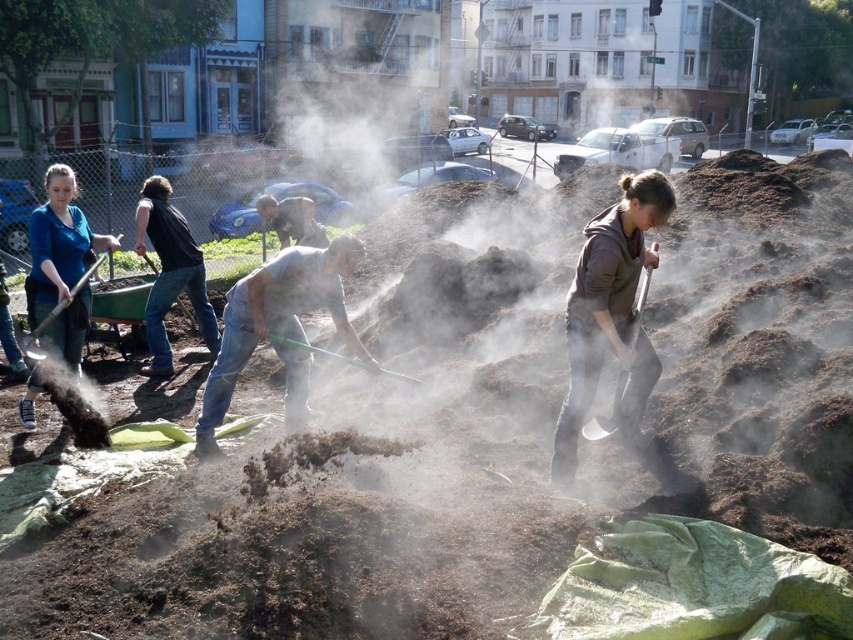
You are standing in the garden area and want to grab the closest shovel to you. Which shovel should you choose between the metallic silver shovel at lower right and the matte black shovel at lower left?

The metallic silver shovel at lower right is closer to the viewer than the matte black shovel at lower left, so you should choose the metallic silver shovel at lower right.

You are a gardener who needs to choose a shovel to work with the large mounds of soil in the foreground. Which shovel between the metallic silver shovel at lower right and the green plastic shovel at center has a wider blade for efficient soil moving?

The green plastic shovel at center has a wider blade than the metallic silver shovel at lower right, making it more efficient for moving large amounts of soil.

You are a photographer trying to capture both the matte blue shirt at left and the light brown leather jacket at center in the same frame. Since you want to ensure both are clearly visible, which clothing item should you focus on first to account for their sizes?

The matte blue shirt at left is larger in size than the light brown leather jacket at center, so you should focus on the matte blue shirt at left first as it occupies more space in the frame.